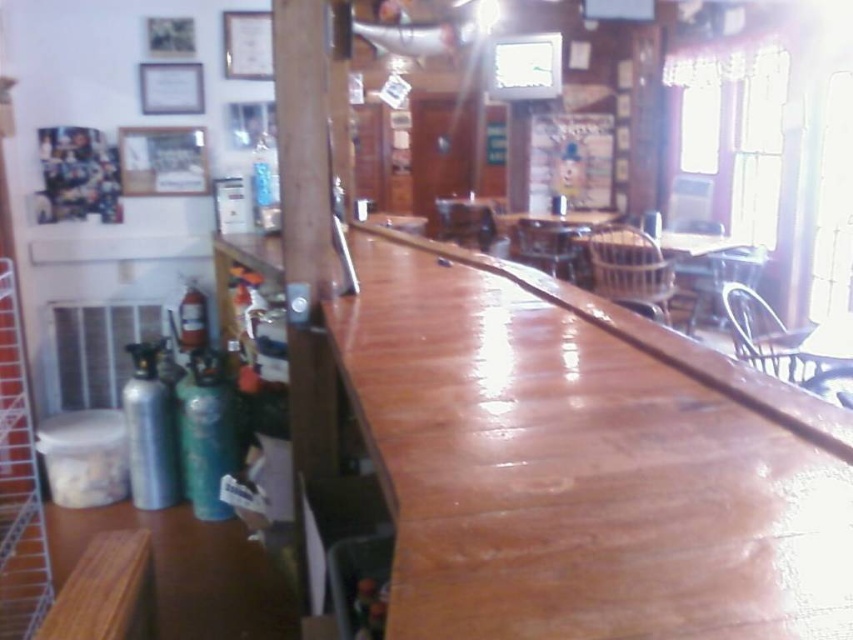
Looking at this image, you are a bartender who needs to reach the clear glass bottle at center to prepare a drink. However, the red glass fire extinguisher at left is blocking your access. Can you move the fire extinguisher to the side to get the bottle?

The clear glass bottle at center is positioned over the red glass fire extinguisher at left, meaning the bottle is above the fire extinguisher. Since the fire extinguisher is below, you can simply reach up to get the bottle without needing to move the extinguisher.

You are a customer in the dining establishment and want to place your phone on the clear glass bottle at center. Can you do that without it falling off?

The clear glass bottle at center is located at coordinates (265, 184). Since the bottle is clear and likely smooth, placing a phone on it might be unstable and could cause it to fall. However, the exact stability depends on the bottle shape and surface, which aren